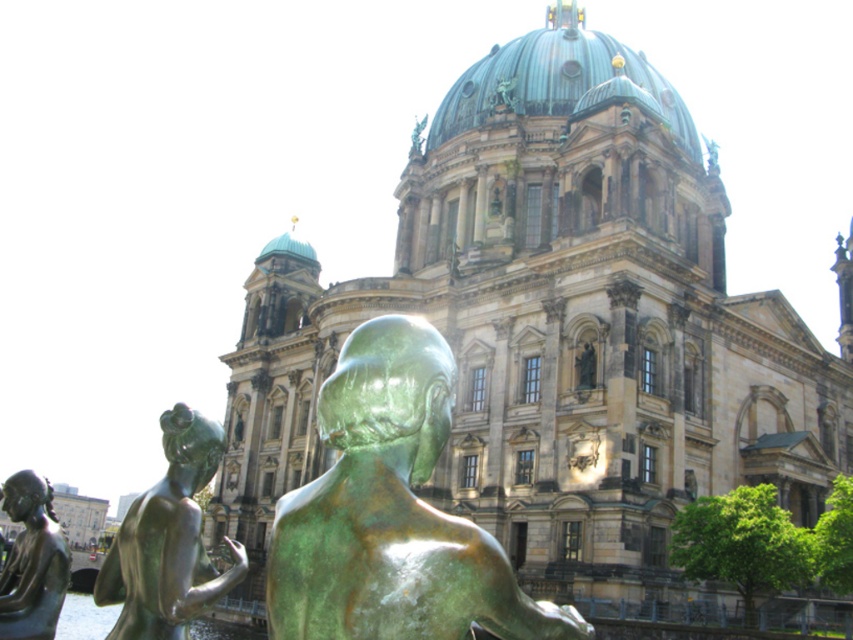
Question: Which point is closer to the camera?

Choices:
 (A) (170, 493)
 (B) (56, 557)
 (C) (289, 548)

Answer: (C)

Question: Does green patina statue at center come in front of bronze statue at left?

Choices:
 (A) no
 (B) yes

Answer: (B)

Question: Which object is closer to the camera taking this photo?

Choices:
 (A) green patina statue at center
 (B) bronze statue at lower left
 (C) bronze statue at left

Answer: (A)

Question: Is bronze statue at lower left smaller than bronze statue at left?

Choices:
 (A) no
 (B) yes

Answer: (A)

Question: Which point appears closest to the camera in this image?

Choices:
 (A) (343, 611)
 (B) (183, 564)
 (C) (13, 588)

Answer: (A)

Question: Where is green patina statue at center located in relation to bronze statue at left in the image?

Choices:
 (A) left
 (B) right

Answer: (B)